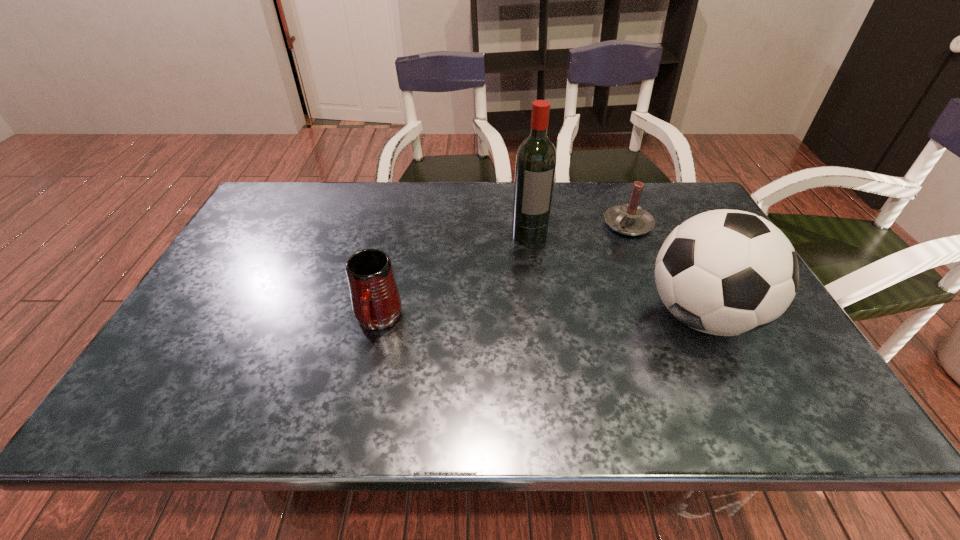
Where is `vacant space at the far left corner of the desktop`? vacant space at the far left corner of the desktop is located at coordinates (288, 183).

Find the location of a particular element. This screenshot has width=960, height=540. free space at the far right corner of the desktop is located at coordinates (x=680, y=219).

At what (x,y) coordinates should I click in order to perform the action: click on free spot at the near right corner of the desktop. Please return your answer as a coordinate pair (x, y). Image resolution: width=960 pixels, height=540 pixels. Looking at the image, I should click on (778, 377).

Identify the location of free space between the leftmost object and the wine bottle. The image size is (960, 540). (453, 278).

Locate an element on the screen. empty space that is in between the soccer ball and the leftmost object is located at coordinates (540, 318).

In order to click on vacant space in between the candle and the wine bottle in this screenshot , I will do `click(579, 230)`.

Locate an element on the screen. vacant space that is in between the soccer ball and the leftmost object is located at coordinates (540, 318).

Find the location of `free spot between the soccer ball and the second object from left to right`. free spot between the soccer ball and the second object from left to right is located at coordinates (615, 275).

The image size is (960, 540). I want to click on free spot between the tallest object and the second tallest object, so click(615, 275).

At what (x,y) coordinates should I click in order to perform the action: click on vacant region between the leftmost object and the second tallest object. Please return your answer as a coordinate pair (x, y). The height and width of the screenshot is (540, 960). Looking at the image, I should click on (540, 318).